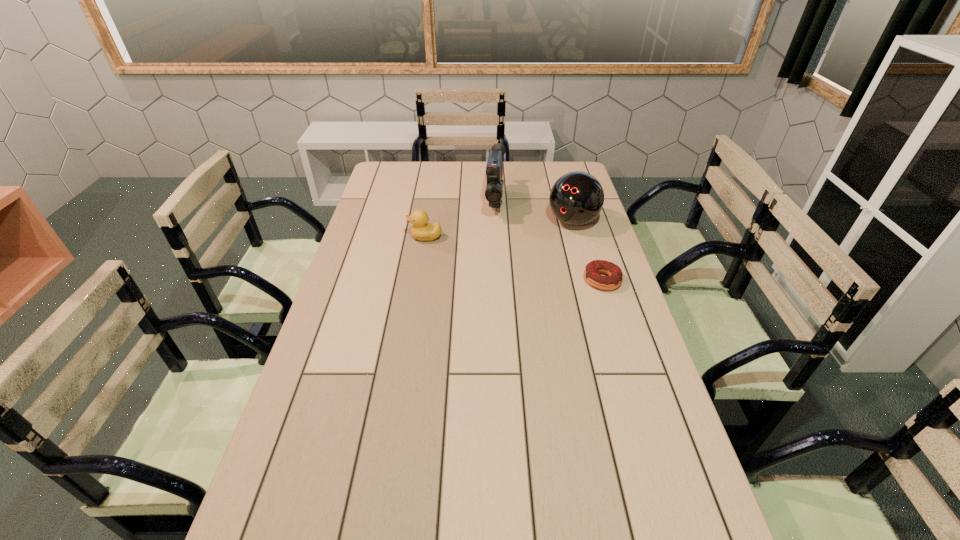
In order to click on free spot at the left edge of the desktop in this screenshot , I will do [360, 235].

In the image, there is a desktop. Where is `vacant space at the right edge`? The width and height of the screenshot is (960, 540). vacant space at the right edge is located at coordinates (603, 357).

I want to click on free location at the far left corner, so click(413, 178).

Where is `vacant area at the near right corner of the desktop`? The height and width of the screenshot is (540, 960). vacant area at the near right corner of the desktop is located at coordinates (637, 529).

Locate an element on the screen. This screenshot has height=540, width=960. blank region between the bowling ball and the camcorder is located at coordinates (534, 212).

Locate an element on the screen. free spot between the doughnut and the bowling ball is located at coordinates (588, 251).

The height and width of the screenshot is (540, 960). Find the location of `vacant point located between the leftmost object and the doughnut`. vacant point located between the leftmost object and the doughnut is located at coordinates tap(514, 259).

Find the location of a particular element. empty location between the duckling and the doughnut is located at coordinates (514, 259).

Find the location of a particular element. This screenshot has height=540, width=960. free space between the nearest object and the duckling is located at coordinates (514, 259).

At what (x,y) coordinates should I click in order to perform the action: click on unoccupied position between the bowling ball and the second shortest object. Please return your answer as a coordinate pair (x, y). The height and width of the screenshot is (540, 960). Looking at the image, I should click on (499, 230).